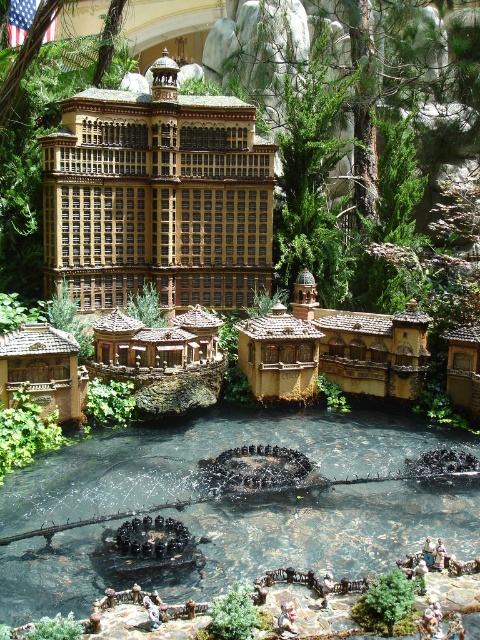
Between point (40, 390) and point (275, 387), which one is positioned behind?

Positioned behind is point (275, 387).

Who is positioned more to the right, wooden hut at center or brown wooden hut at center?

brown wooden hut at center

Does point (56, 369) lie in front of point (290, 330)?

Yes, point (56, 369) is in front of point (290, 330).

You are a GUI agent. You are given a task and a screenshot of the screen. Output one action in this format:
    pyautogui.click(x=<x>, y=<y>)
    Task: Click on the wooden hut at center
    
    Given the screenshot: What is the action you would take?
    pyautogui.click(x=44, y=369)

Can you confirm if brown textured building at center is positioned above brown wooden hut at center?

Yes.

Can you confirm if brown textured building at center is positioned to the right of brown wooden hut at center?

In fact, brown textured building at center is to the left of brown wooden hut at center.

The image size is (480, 640). Describe the element at coordinates (157, 196) in the screenshot. I see `brown textured building at center` at that location.

Where is `brown textured building at center`? brown textured building at center is located at coordinates (157, 196).

Is brown textured building at center thinner than wooden hut at center?

In fact, brown textured building at center might be wider than wooden hut at center.

Is brown textured building at center above wooden hut at center?

Yes.

At what (x,y) coordinates should I click in order to perform the action: click on brown textured building at center. Please return your answer as a coordinate pair (x, y). The height and width of the screenshot is (640, 480). Looking at the image, I should click on (157, 196).